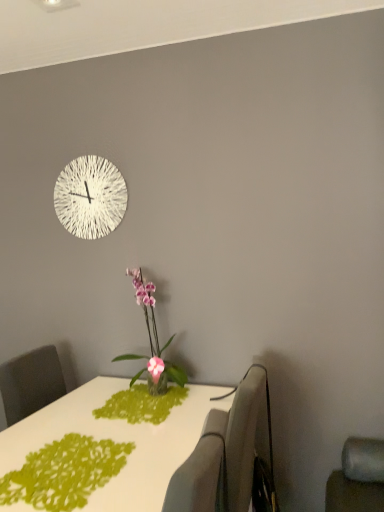
Question: Are white glossy table at center and gray fabric swivel chair at right, acting as the second swivel chair starting from the front, making contact?

Choices:
 (A) no
 (B) yes

Answer: (A)

Question: Is white glossy table at center looking in the opposite direction of gray fabric swivel chair at right, placed as the 1th swivel chair when sorted from back to front?

Choices:
 (A) yes
 (B) no

Answer: (B)

Question: From a real-world perspective, is white glossy table at center located beneath gray fabric swivel chair at right, acting as the second swivel chair starting from the front?

Choices:
 (A) no
 (B) yes

Answer: (B)

Question: Is white glossy table at center positioned far away from gray fabric swivel chair at right, placed as the 1th swivel chair when sorted from back to front?

Choices:
 (A) no
 (B) yes

Answer: (A)

Question: Can you confirm if white glossy table at center is thinner than gray fabric swivel chair at right, placed as the 1th swivel chair when sorted from back to front?

Choices:
 (A) yes
 (B) no

Answer: (B)

Question: Does white glossy table at center turn towards gray fabric swivel chair at right, placed as the 1th swivel chair when sorted from back to front?

Choices:
 (A) yes
 (B) no

Answer: (B)

Question: Is gray fabric swivel chair at right, acting as the second swivel chair starting from the front, aimed at pink glossy orchid at center?

Choices:
 (A) no
 (B) yes

Answer: (A)

Question: Can you confirm if gray fabric swivel chair at right, placed as the 1th swivel chair when sorted from back to front, is smaller than pink glossy orchid at center?

Choices:
 (A) yes
 (B) no

Answer: (A)

Question: Is gray fabric swivel chair at right, acting as the second swivel chair starting from the front, thinner than pink glossy orchid at center?

Choices:
 (A) yes
 (B) no

Answer: (A)

Question: Would you say gray fabric swivel chair at right, placed as the 1th swivel chair when sorted from back to front, is outside pink glossy orchid at center?

Choices:
 (A) yes
 (B) no

Answer: (A)

Question: Does gray fabric swivel chair at right, placed as the 1th swivel chair when sorted from back to front, have a lesser height compared to pink glossy orchid at center?

Choices:
 (A) yes
 (B) no

Answer: (B)

Question: Does gray fabric swivel chair at right, acting as the second swivel chair starting from the front, come in front of pink glossy orchid at center?

Choices:
 (A) no
 (B) yes

Answer: (B)

Question: Would you consider white textured clock at upper center to be distant from white glossy table at center?

Choices:
 (A) no
 (B) yes

Answer: (B)